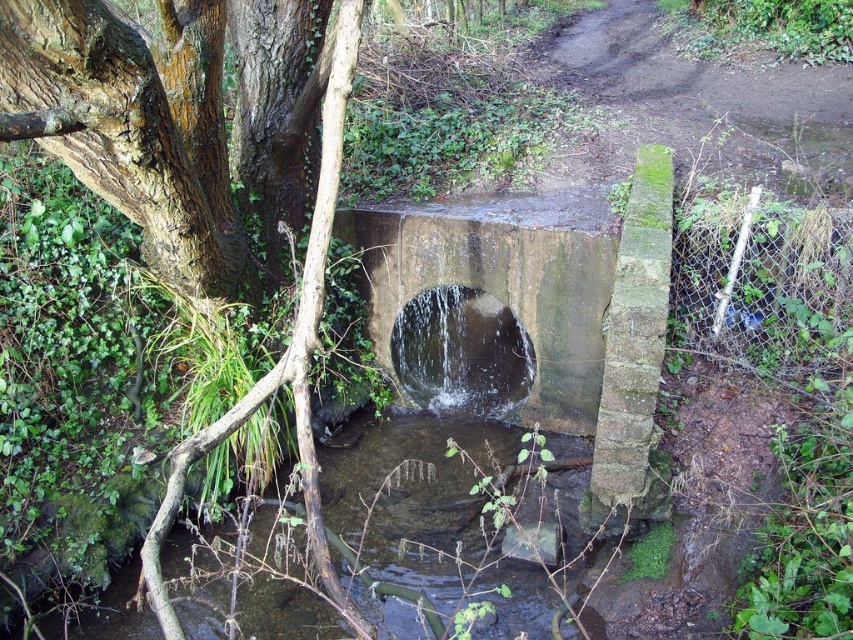
Question: Which of the following is the closest to the observer?

Choices:
 (A) concrete/rough concrete at center
 (B) clear water at center

Answer: (B)

Question: In this image, where is concrete/rough concrete at center located relative to clear water at center?

Choices:
 (A) below
 (B) above

Answer: (B)

Question: Can you confirm if concrete/rough concrete at center is positioned below clear water at center?

Choices:
 (A) yes
 (B) no

Answer: (B)

Question: Observing the image, what is the correct spatial positioning of concrete/rough concrete at center in reference to clear water at center?

Choices:
 (A) below
 (B) above

Answer: (B)

Question: Which point is farther to the camera?

Choices:
 (A) clear water at center
 (B) concrete/rough concrete at center

Answer: (B)